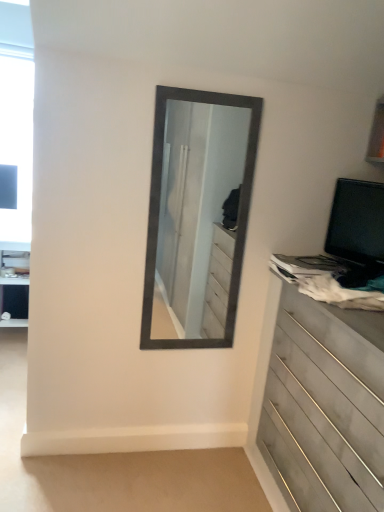
Question: Is wooden chest of drawers at right in front of or behind black glossy computer monitor at right in the image?

Choices:
 (A) front
 (B) behind

Answer: (A)

Question: Is wooden chest of drawers at right wider or thinner than black glossy computer monitor at right?

Choices:
 (A) thin
 (B) wide

Answer: (B)

Question: Is wooden chest of drawers at right situated inside black glossy computer monitor at right or outside?

Choices:
 (A) inside
 (B) outside

Answer: (B)

Question: Considering the positions of black glossy computer monitor at right and wooden chest of drawers at right in the image, is black glossy computer monitor at right wider or thinner than wooden chest of drawers at right?

Choices:
 (A) wide
 (B) thin

Answer: (B)

Question: In terms of size, does black glossy computer monitor at right appear bigger or smaller than wooden chest of drawers at right?

Choices:
 (A) big
 (B) small

Answer: (B)

Question: From the image's perspective, relative to wooden chest of drawers at right, is black glossy computer monitor at right above or below?

Choices:
 (A) above
 (B) below

Answer: (A)

Question: From a real-world perspective, is black glossy computer monitor at right physically located above or below wooden chest of drawers at right?

Choices:
 (A) above
 (B) below

Answer: (A)